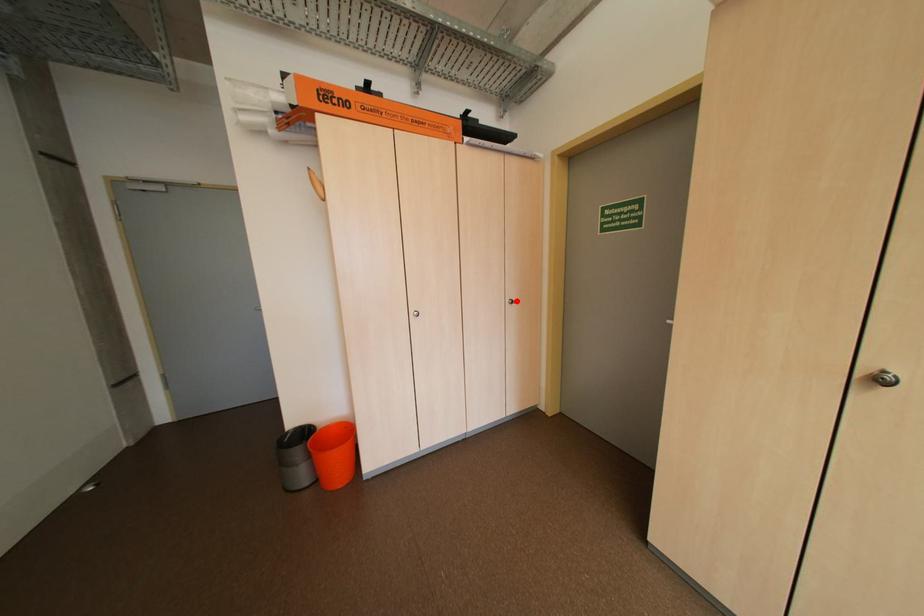
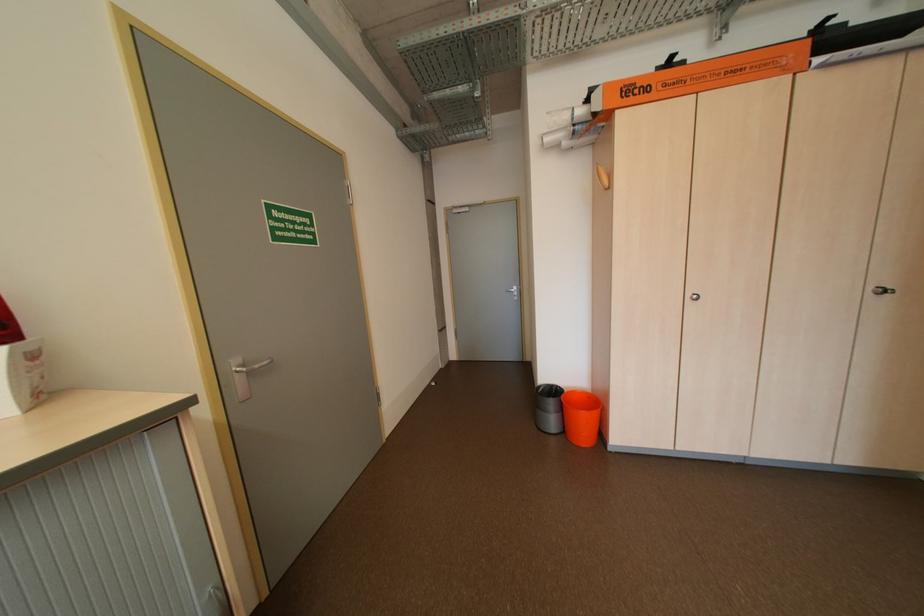
In the second image, find the point that corresponds to the highlighted location in the first image.

(880, 290)